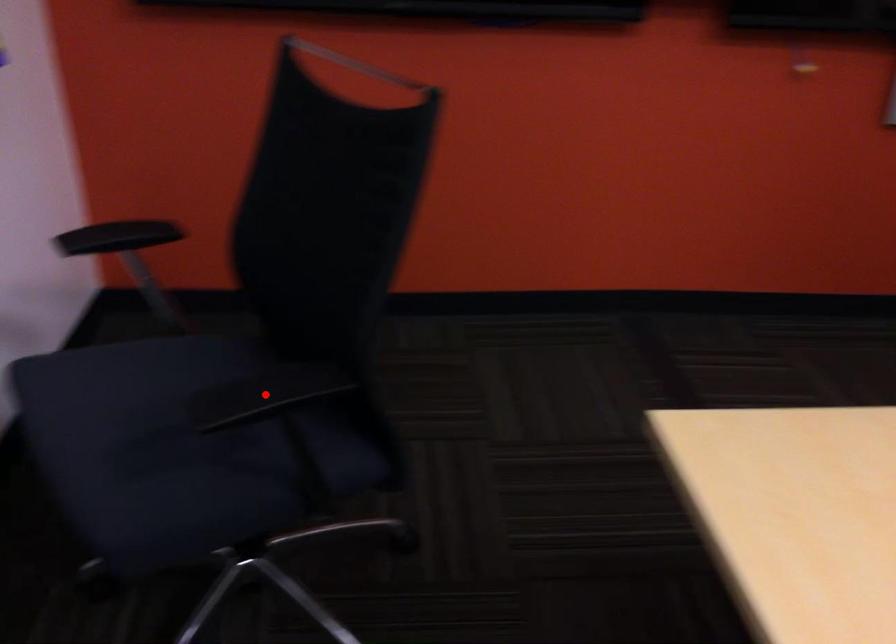
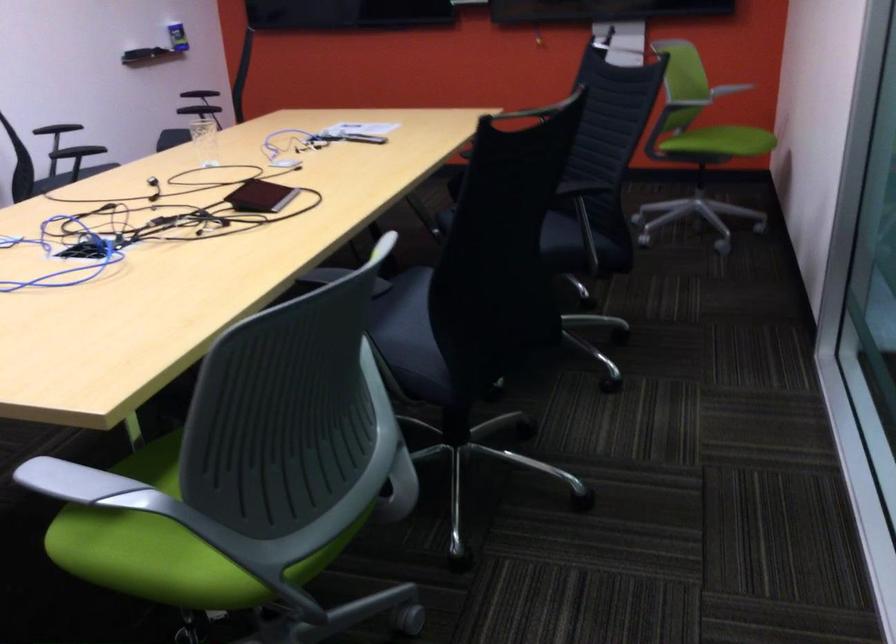
Question: I am providing you with two images of the same scene from different viewpoints. A red point is marked on the first image. Is the red point's position out of view in image 2?

Choices:
 (A) Yes
 (B) No

Answer: (A)